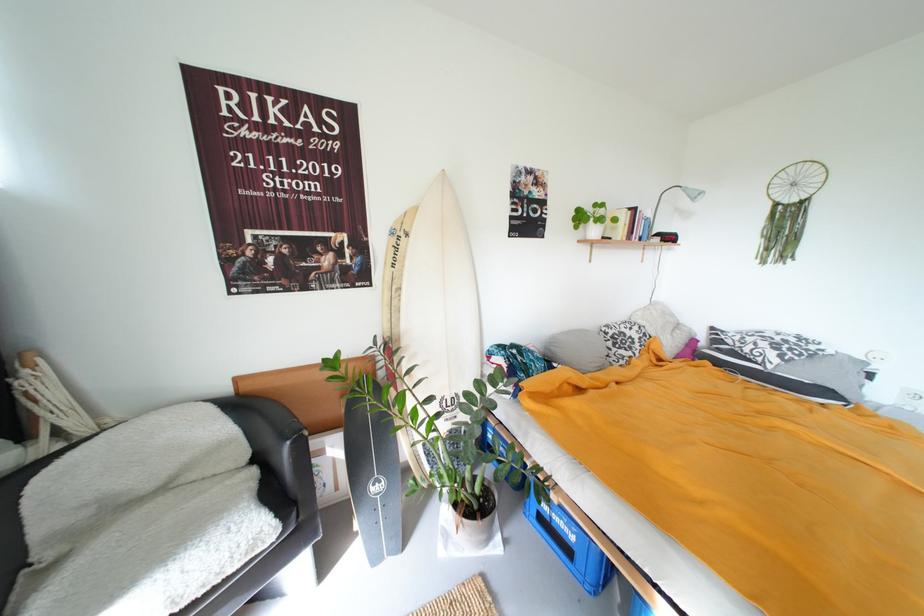
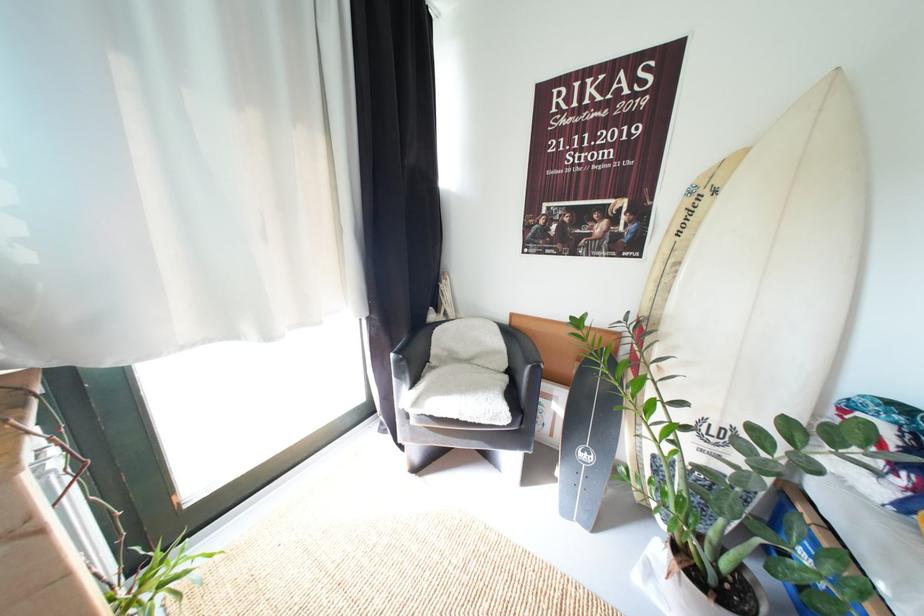
Question: The camera is either moving clockwise (left) or counter-clockwise (right) around the object. The first image is from the beginning of the video and the second image is from the end. Is the camera moving left or right when shooting the video?

Choices:
 (A) Left
 (B) Right

Answer: (B)